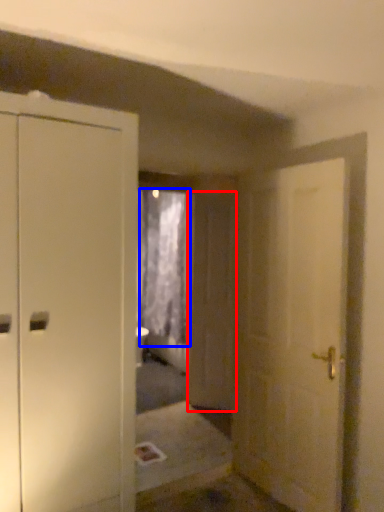
Question: Which object is closer to the camera taking this photo, screen door (highlighted by a red box) or curtain (highlighted by a blue box)?

Choices:
 (A) screen door
 (B) curtain

Answer: (A)